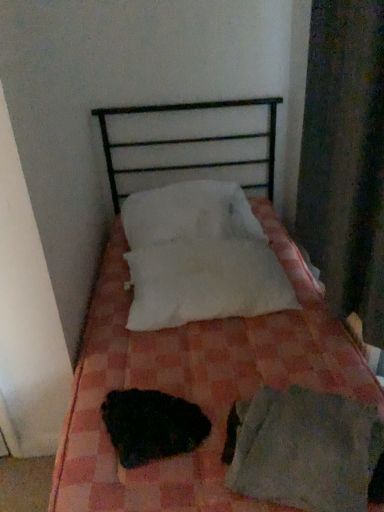
Question: Is black fuzzy animal at center completely or partially inside white soft pillow at center, which ranks as the 1th pillow in top-to-bottom order?

Choices:
 (A) no
 (B) yes

Answer: (A)

Question: Is white soft pillow at center, the 2th pillow from the bottom, to the left of black fuzzy animal at center from the viewer's perspective?

Choices:
 (A) yes
 (B) no

Answer: (B)

Question: Does white soft pillow at center, the 2th pillow from the bottom, appear on the right side of black fuzzy animal at center?

Choices:
 (A) yes
 (B) no

Answer: (A)

Question: Does white soft pillow at center, the 2th pillow from the bottom, lie in front of black fuzzy animal at center?

Choices:
 (A) no
 (B) yes

Answer: (A)

Question: From a real-world perspective, is white soft pillow at center, which ranks as the 1th pillow in top-to-bottom order, physically above black fuzzy animal at center?

Choices:
 (A) no
 (B) yes

Answer: (B)

Question: Is the position of white soft pillow at center, the 2th pillow from the bottom, more distant than that of black fuzzy animal at center?

Choices:
 (A) no
 (B) yes

Answer: (B)

Question: Considering the relative sizes of light gray cotton sheet at lower right and black fuzzy animal at center in the image provided, is light gray cotton sheet at lower right smaller than black fuzzy animal at center?

Choices:
 (A) yes
 (B) no

Answer: (B)

Question: Is light gray cotton sheet at lower right turned away from black fuzzy animal at center?

Choices:
 (A) yes
 (B) no

Answer: (B)

Question: Is the depth of light gray cotton sheet at lower right greater than that of black fuzzy animal at center?

Choices:
 (A) no
 (B) yes

Answer: (A)

Question: Is black fuzzy animal at center a part of light gray cotton sheet at lower right?

Choices:
 (A) yes
 (B) no

Answer: (B)

Question: Can you confirm if light gray cotton sheet at lower right is shorter than black fuzzy animal at center?

Choices:
 (A) yes
 (B) no

Answer: (B)

Question: Does light gray cotton sheet at lower right have a larger size compared to black fuzzy animal at center?

Choices:
 (A) no
 (B) yes

Answer: (B)

Question: Is white fluffy pillow at center, which ranks as the 1th pillow in bottom-to-top order, directly adjacent to pink checkered bed at center?

Choices:
 (A) no
 (B) yes

Answer: (A)